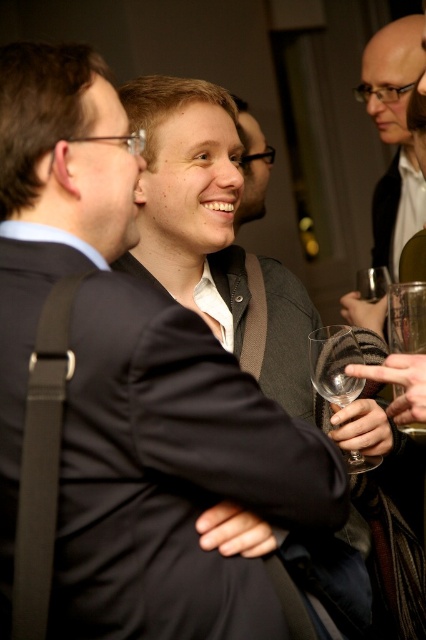
Question: Does transparent glass wine glass at center appear over matte black sweater at center?

Choices:
 (A) yes
 (B) no

Answer: (B)

Question: Which is farther from the matte black sweater at center?

Choices:
 (A) transparent glass wine glass at center
 (B) matte black suit at upper right

Answer: (A)

Question: Which of the following is the farthest from the observer?

Choices:
 (A) matte black sweater at center
 (B) matte black suit at upper right
 (C) transparent glass wine glass at center

Answer: (A)

Question: Is matte black suit at upper right positioned in front of transparent glass wine glass at center?

Choices:
 (A) yes
 (B) no

Answer: (B)

Question: Estimate the real-world distances between objects in this image. Which object is farther from the matte black sweater at center?

Choices:
 (A) transparent glass wine glass at center
 (B) matte black suit at upper right

Answer: (A)

Question: Can you confirm if matte black suit at upper right is positioned to the left of transparent glass wine glass at center?

Choices:
 (A) yes
 (B) no

Answer: (B)